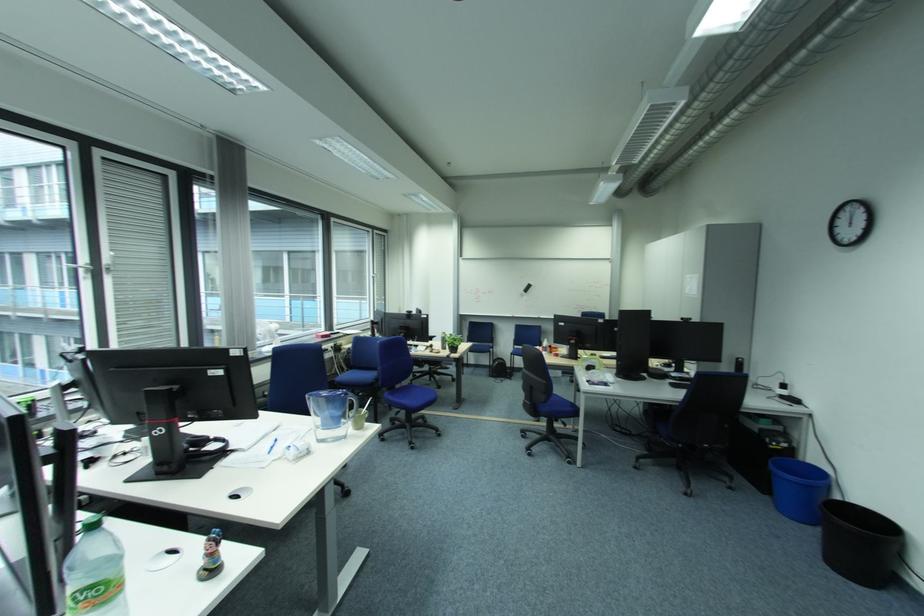
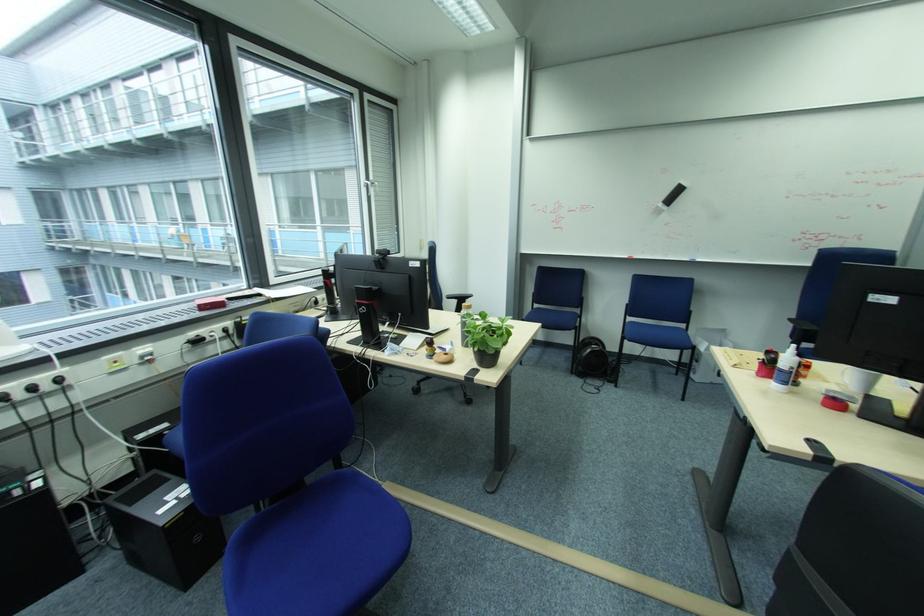
Where in the second image is the point corresponding to pixel 531 293 from the first image?

(669, 206)